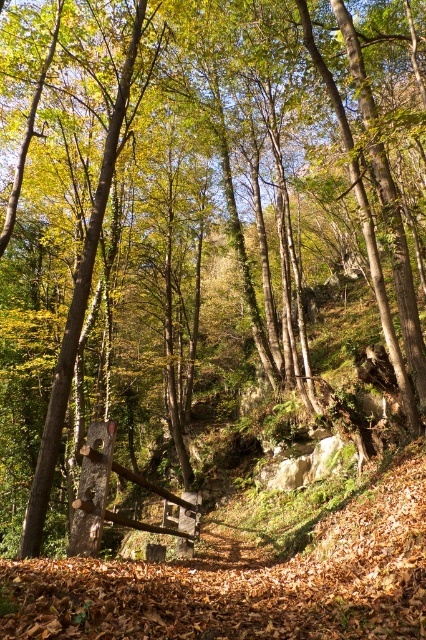
What is located at the coordinates point (77,314) in the forest scene?

At point (77,314) lies brown wood tree at center.

Based on the photo, you are a hiker who wants to cross a stream using the wooden log at center. However, there is a brown wood tree at center blocking your path. Can you still cross the stream by moving around the tree?

The brown wood tree at center is positioned over the wooden log at center, so the tree is blocking the log entirely. You cannot cross the stream by moving around the tree because the tree is directly above the log, making it inaccessible.

You are a hiker walking along a forest path and see the brown wood tree at center and the wooden log at center. Which object is positioned to the left?

The brown wood tree at center is to the left of the wooden log at center.